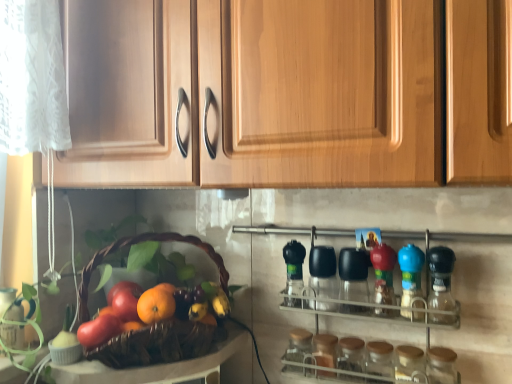
Question: Looking at their shapes, would you say shiny purple grapes at center is wider or thinner than matte red apple at lower left, placed as the 1th apple when sorted from front to back?

Choices:
 (A) thin
 (B) wide

Answer: (B)

Question: Considering their positions, is shiny purple grapes at center located in front of or behind matte red apple at lower left, the 2th apple positioned from the back?

Choices:
 (A) front
 (B) behind

Answer: (B)

Question: Based on their relative distances, which object is nearer to the brown woven basket at lower left?

Choices:
 (A) blue plastic bottle at right, placed as the 3th bottle when sorted from left to right
 (B) transparent plastic spice rack at center
 (C) transparent glass jar at lower center, positioned as the 3th bottle in right-to-left order
 (D) matte red apple at lower left, which appears as the second apple when viewed from the front
 (E) orange matte at center

Answer: (E)

Question: Estimate the real-world distances between objects in this image. Which object is farther from the transparent glass jar at lower center, the second bottle positioned from the left?

Choices:
 (A) orange matte at center
 (B) transparent plastic spice rack at center
 (C) blue plastic bottle at right, the second bottle viewed from the right
 (D) brown woven basket at lower left
 (E) matte red apple at lower left, placed as the first apple when sorted from back to front

Answer: (E)